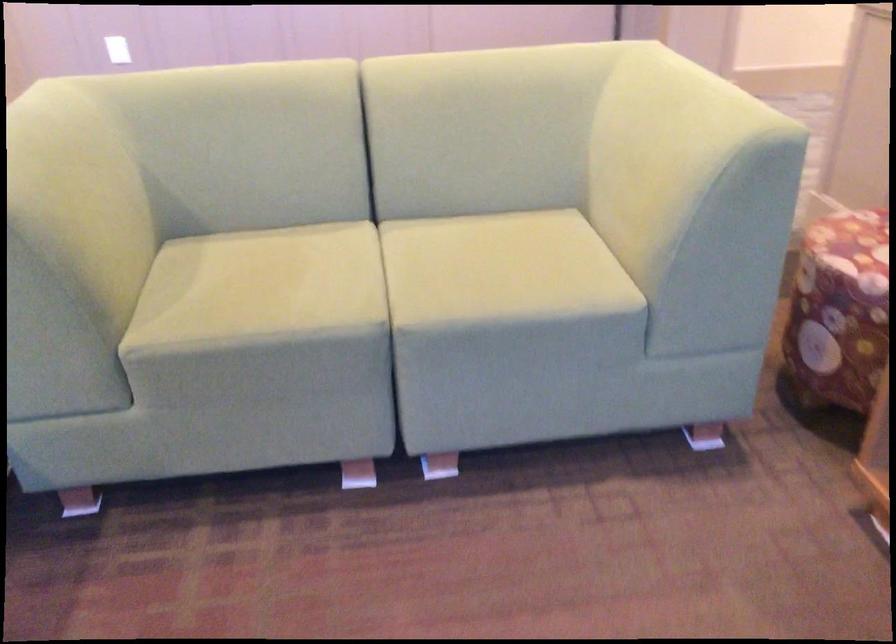
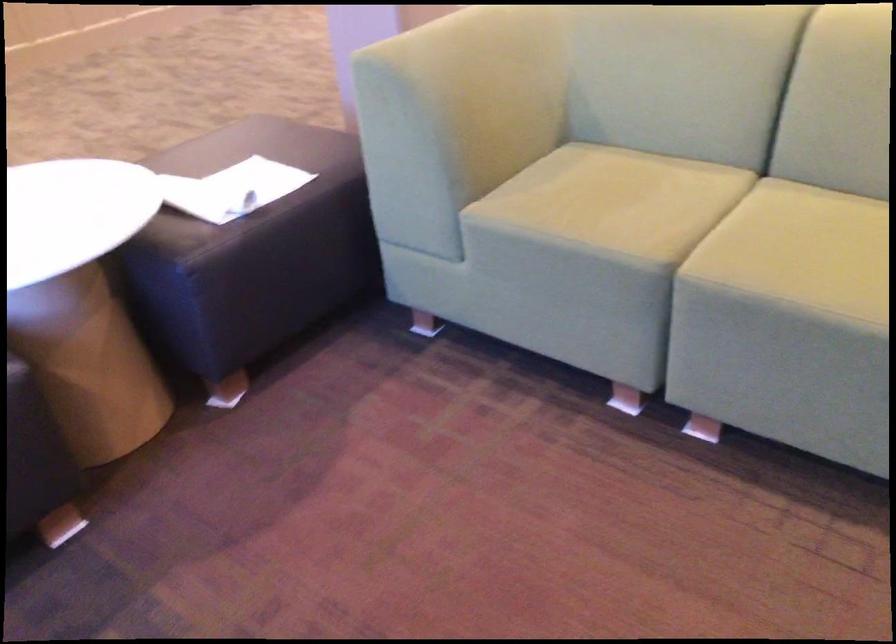
In the second image, find the point that corresponds to the point at 492,257 in the first image.

(837, 238)